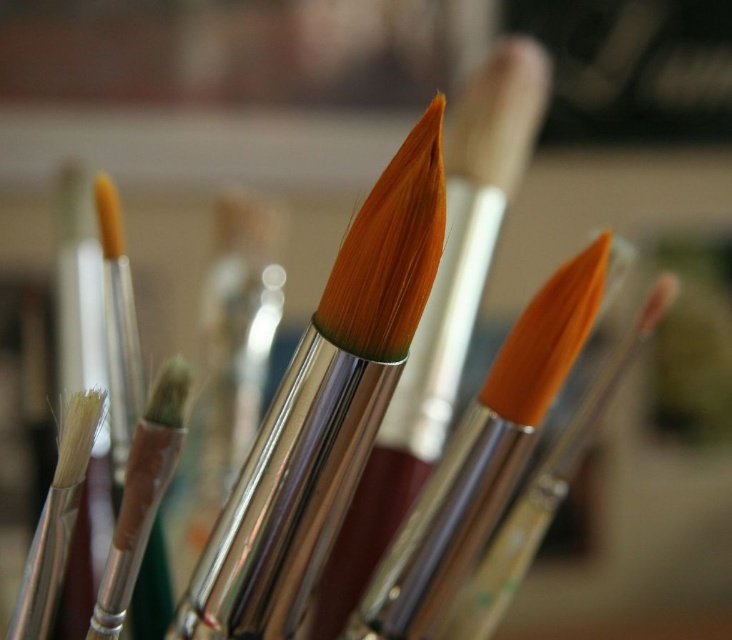
You are an artist trying to locate your orange metallic paint brush at center. You see a point marked at coordinates (549, 484). Is this point likely on your orange metallic paint brush at center?

Yes, the point at (549, 484) corresponds to the orange metallic paint brush at center, so it is likely on your orange metallic paint brush at center.